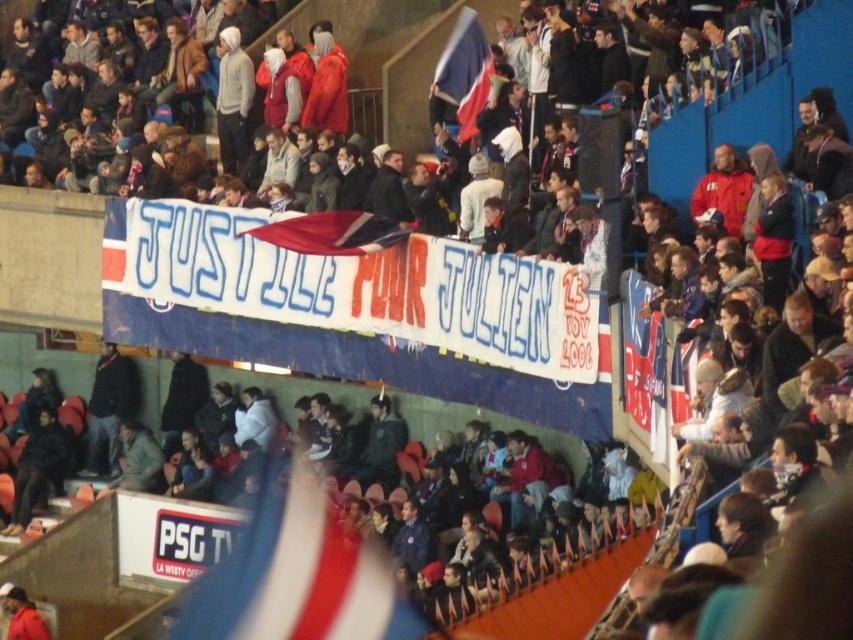
Can you confirm if red fabric banner at center is thinner than red fabric flag at center?

Yes, red fabric banner at center is thinner than red fabric flag at center.

Who is more forward, (654,410) or (344,228)?

Positioned in front is point (654,410).

The image size is (853, 640). In order to click on red fabric banner at center in this screenshot , I will do `click(643, 362)`.

Between dark blue jacket at center and red and white striped flag at upper center, which one appears on the right side from the viewer's perspective?

red and white striped flag at upper center

Which is above, dark blue jacket at center or red and white striped flag at upper center?

red and white striped flag at upper center is higher up.

Is point (71, 371) positioned after point (471, 77)?

Yes, it is.

This screenshot has height=640, width=853. Identify the location of dark blue jacket at center. (567, 596).

Is blue fabric banner at center to the left of red and white striped flag at upper center from the viewer's perspective?

Indeed, blue fabric banner at center is positioned on the left side of red and white striped flag at upper center.

Which is in front, point (422, 241) or point (457, 60)?

Point (422, 241) is more forward.

Identify the location of blue fabric banner at center. (363, 288).